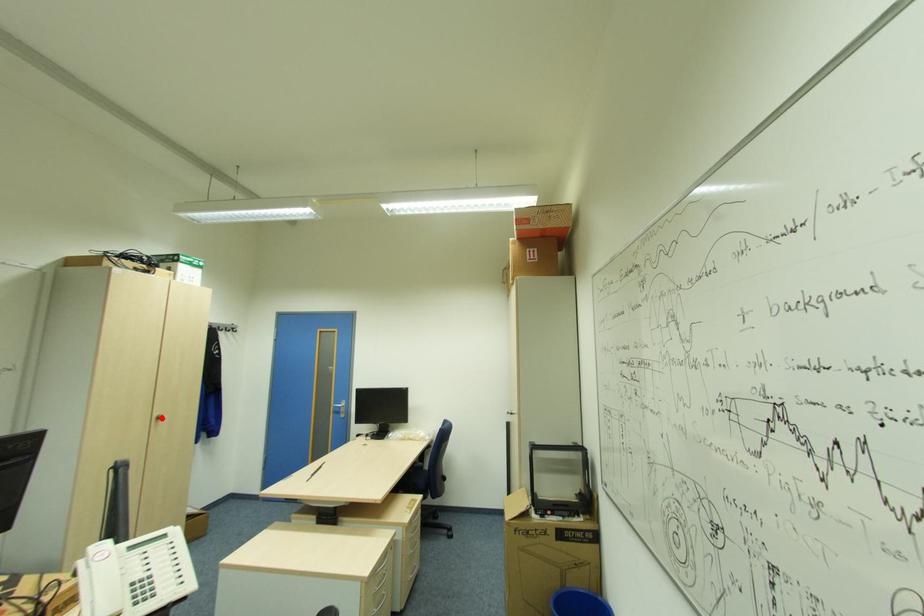
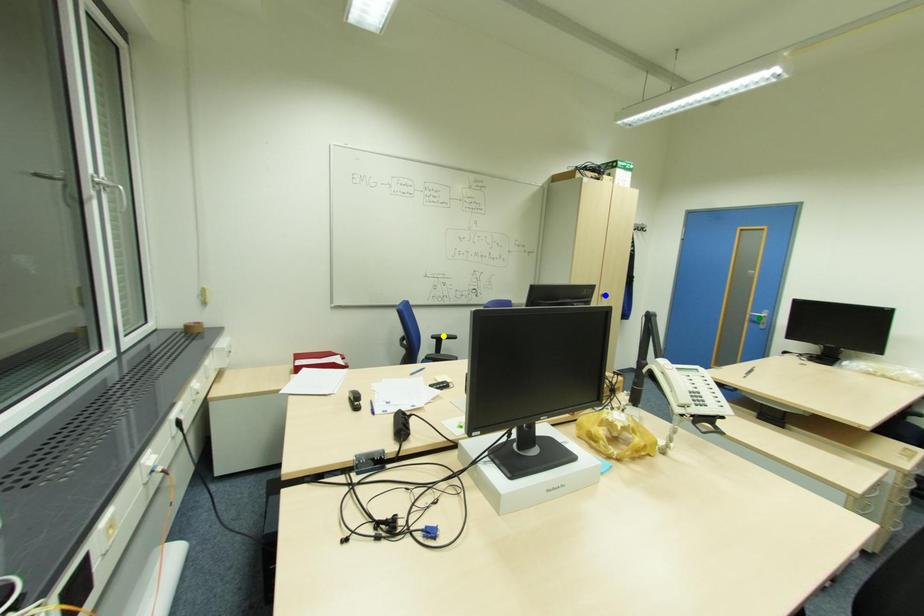
Question: I am providing you with two images of the same scene from different viewpoints. A red point is marked on the first image. You are given multiple points on the second image. Which point in image 2 is actually the same real-world point as the red point in image 1?

Choices:
 (A) green point
 (B) blue point
 (C) yellow point

Answer: (B)